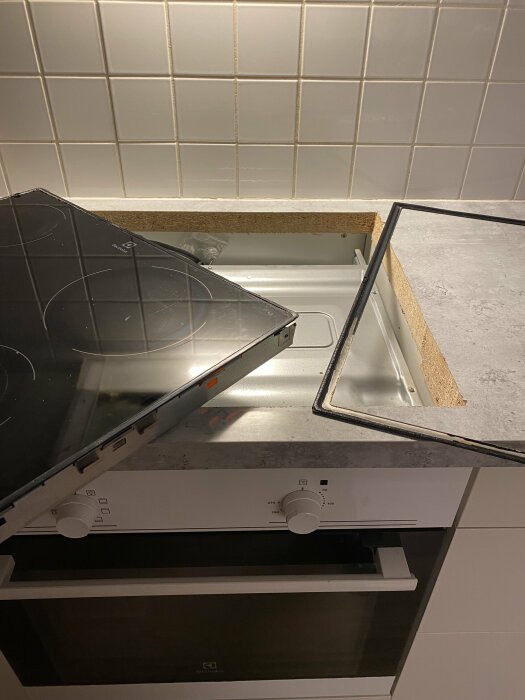
Where is `front right burner`? This screenshot has width=525, height=700. front right burner is located at coordinates (149, 337).